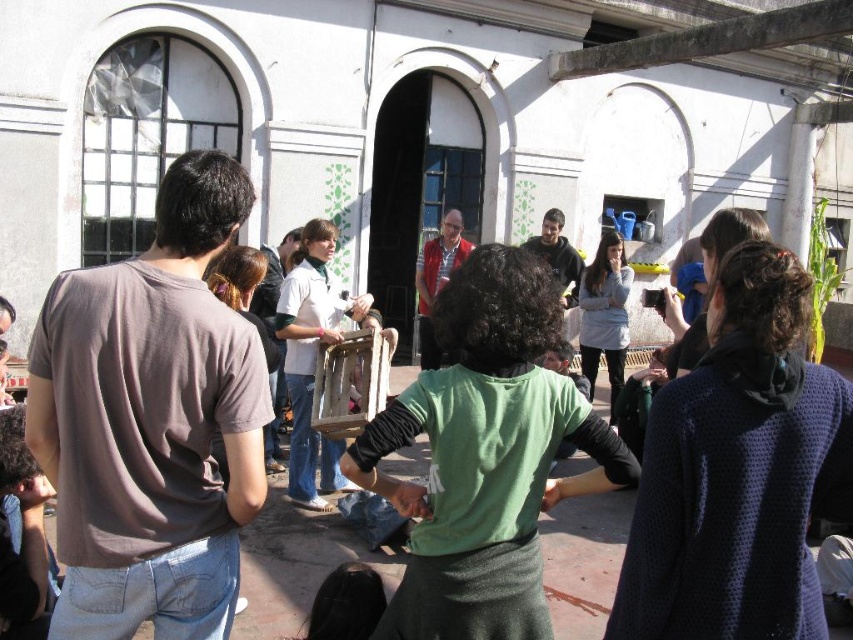
Question: Can you confirm if brown cotton t-shirt at left is wider than white cotton shirt at center?

Choices:
 (A) yes
 (B) no

Answer: (A)

Question: Which point is closer to the camera?

Choices:
 (A) smooth green hand at center
 (B) brown cotton t-shirt at left
 (C) wooden frame at center
 (D) wooden lantern at center

Answer: (B)

Question: Which object is the closest to the red plaid shirt at center?

Choices:
 (A) white cotton shirt at center
 (B) dark gray hoodie at center
 (C) wooden lantern at center

Answer: (B)

Question: Which point is closer to the camera taking this photo?

Choices:
 (A) (283, 340)
 (B) (546, 506)
 (C) (456, 211)

Answer: (B)

Question: Can you confirm if dark gray hoodie at center is bigger than smooth green hand at center?

Choices:
 (A) no
 (B) yes

Answer: (B)

Question: Can you confirm if dark gray hoodie at center is thinner than smooth green hand at center?

Choices:
 (A) yes
 (B) no

Answer: (B)